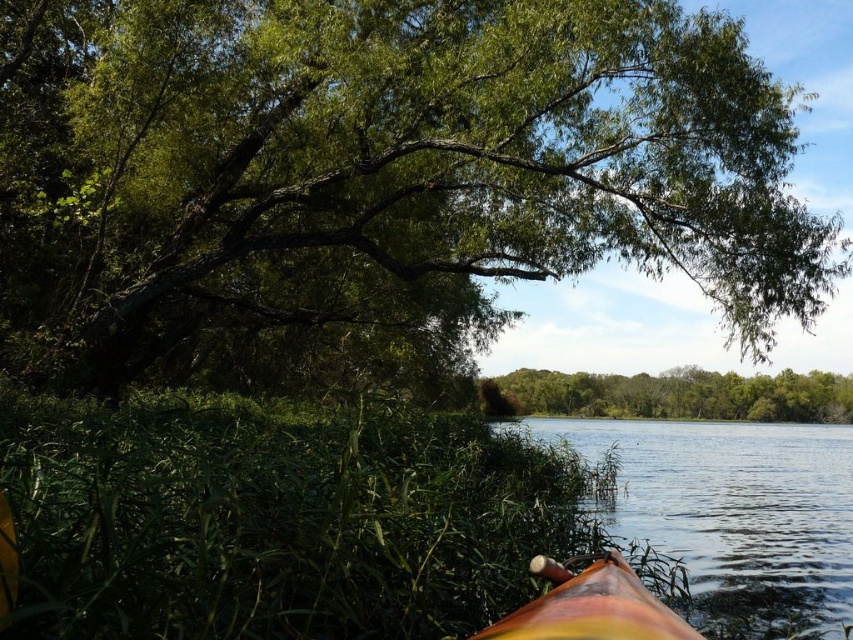
Find the location of a particular element. smooth brown water at lower right is located at coordinates pos(732,497).

Between smooth brown water at lower right and green leafy trees at center, which one is positioned higher?

green leafy trees at center is above.

Image resolution: width=853 pixels, height=640 pixels. What do you see at coordinates (732, 497) in the screenshot?
I see `smooth brown water at lower right` at bounding box center [732, 497].

Find the location of a particular element. smooth brown water at lower right is located at coordinates (732, 497).

Who is taller, green leafy trees at center or rainbow-colored wood boat at lower center?

green leafy trees at center is taller.

Does green leafy trees at center have a smaller size compared to rainbow-colored wood boat at lower center?

No.

Which is behind, point (848, 384) or point (624, 600)?

Positioned behind is point (848, 384).

Image resolution: width=853 pixels, height=640 pixels. I want to click on green leafy trees at center, so click(x=682, y=394).

Is smooth brown water at lower right shorter than rainbow-colored wood boat at lower center?

Incorrect, smooth brown water at lower right's height does not fall short of rainbow-colored wood boat at lower center's.

Measure the distance between smooth brown water at lower right and camera.

8.91 meters

Where is `smooth brown water at lower right`? Image resolution: width=853 pixels, height=640 pixels. smooth brown water at lower right is located at coordinates (732, 497).